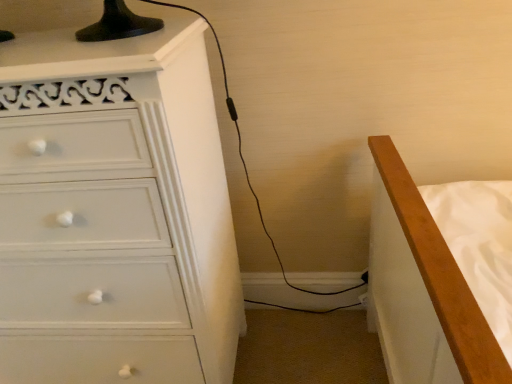
Question: Should I look upward or downward to see white glossy chest of drawers at left?

Choices:
 (A) down
 (B) up

Answer: (A)